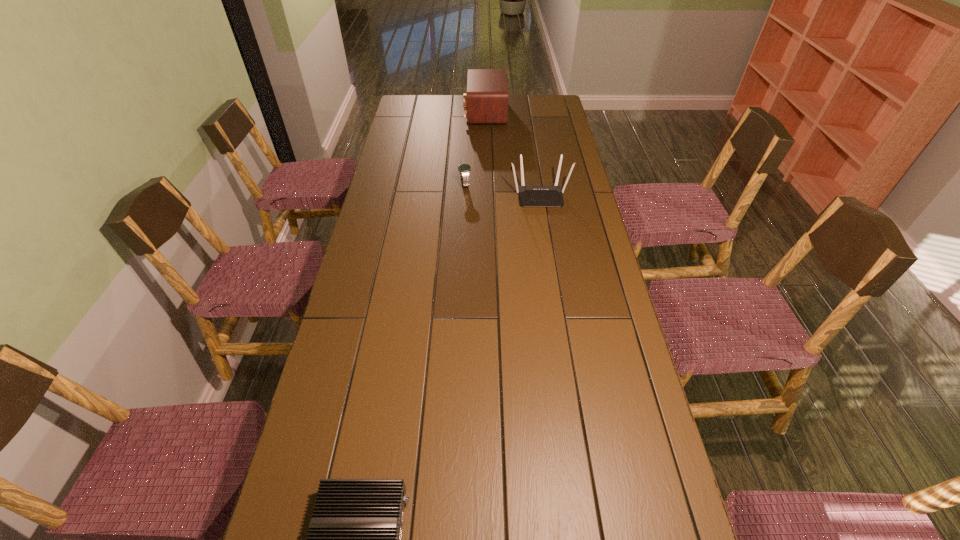
Where is `object that is at the right edge`? object that is at the right edge is located at coordinates (530, 196).

The height and width of the screenshot is (540, 960). I want to click on vacant space at the far edge of the desktop, so click(523, 106).

Locate an element on the screen. Image resolution: width=960 pixels, height=540 pixels. vacant space at the left edge is located at coordinates (409, 217).

Image resolution: width=960 pixels, height=540 pixels. I want to click on vacant space at the right edge of the desktop, so click(556, 211).

Find the location of a particular element. Image resolution: width=960 pixels, height=540 pixels. vacant space that is in between the farther router and the farthest object is located at coordinates coord(513,154).

Identify the location of empty space between the taller router and the watch. The width and height of the screenshot is (960, 540). (502, 190).

Locate an element on the screen. The image size is (960, 540). vacant space that is in between the watch and the farthest object is located at coordinates (475, 148).

Where is `free space between the taller router and the farthest object`? This screenshot has height=540, width=960. free space between the taller router and the farthest object is located at coordinates (513, 154).

Find the location of a particular element. free spot between the radio receiver and the watch is located at coordinates (475, 148).

Locate an element on the screen. The width and height of the screenshot is (960, 540). the third closest object relative to the radio receiver is located at coordinates [x=354, y=539].